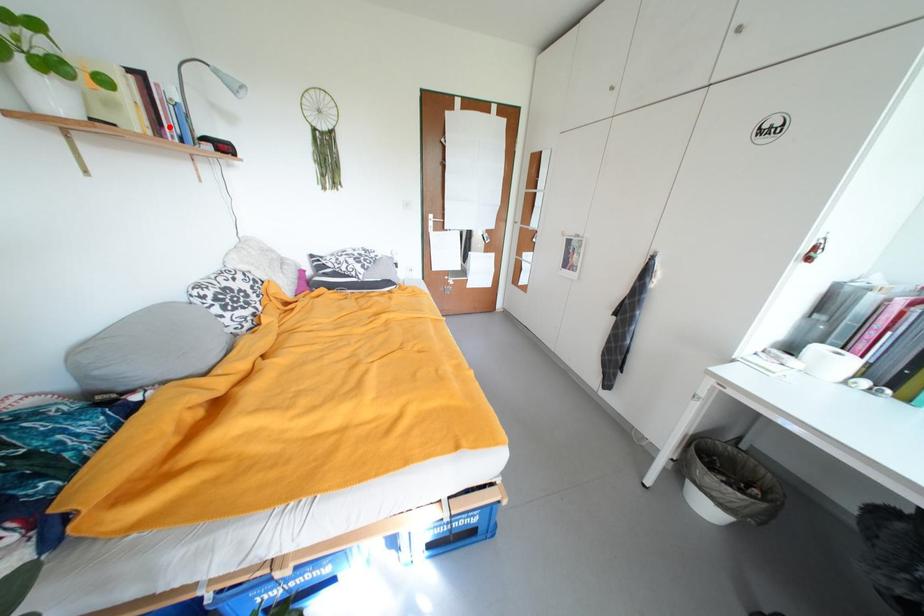
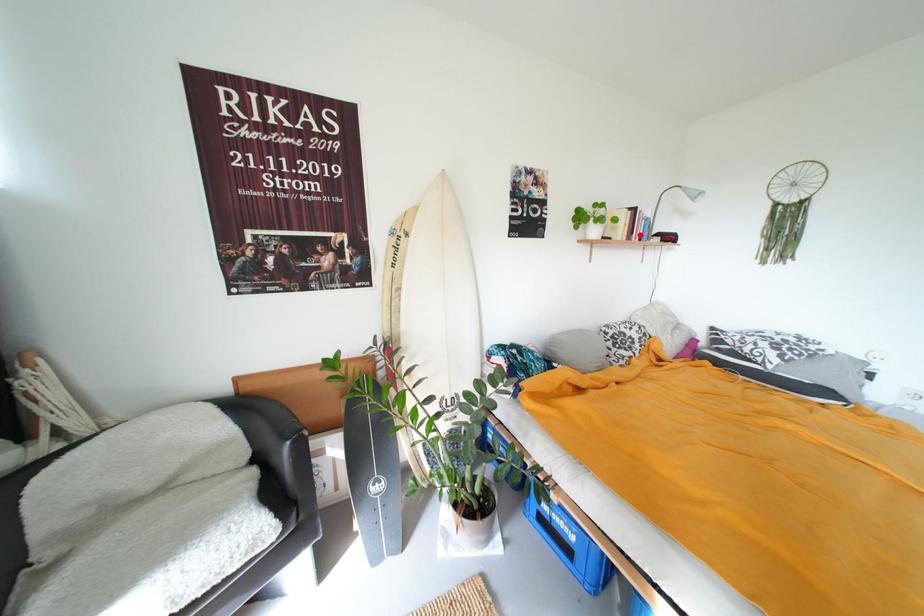
I am providing you with two images of the same scene from different viewpoints. A red point is marked on the first image and another point is marked on the second image. Does the point marked in image1 correspond to the same location as the one in image2?

Yes